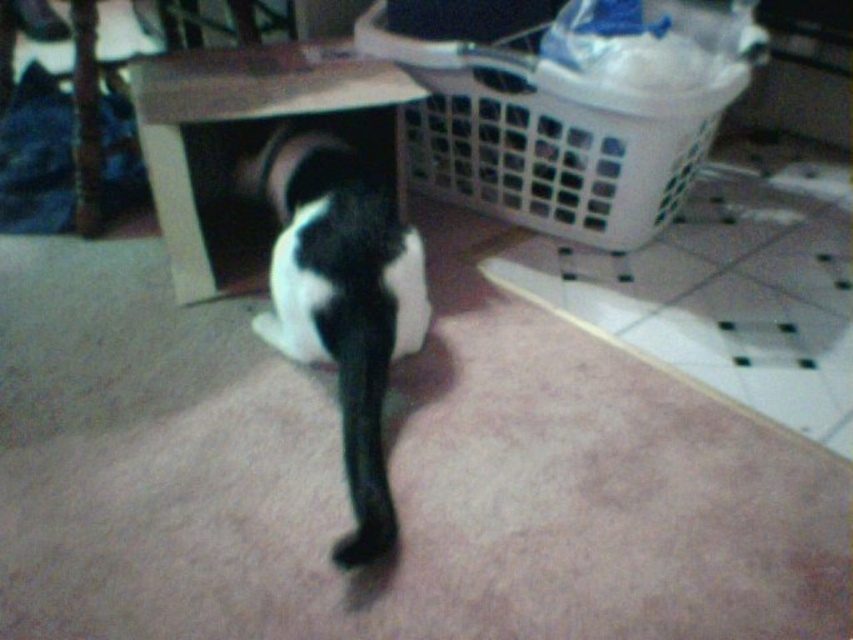
Question: Which point is farther to the camera?

Choices:
 (A) (294, 205)
 (B) (526, 161)

Answer: (B)

Question: Is black fur cat at center further to the viewer compared to matte cardboard box at center?

Choices:
 (A) no
 (B) yes

Answer: (A)

Question: Which object is positioned closest to the black fur cat at center?

Choices:
 (A) white plastic laundry basket at upper right
 (B) matte cardboard box at center

Answer: (B)

Question: Does black fur cat at center have a smaller size compared to matte cardboard box at center?

Choices:
 (A) yes
 (B) no

Answer: (A)

Question: Which point appears farthest from the camera in this image?

Choices:
 (A) (223, 200)
 (B) (537, 198)
 (C) (422, 300)

Answer: (A)

Question: Does black fur cat at center have a smaller size compared to matte cardboard box at center?

Choices:
 (A) no
 (B) yes

Answer: (B)